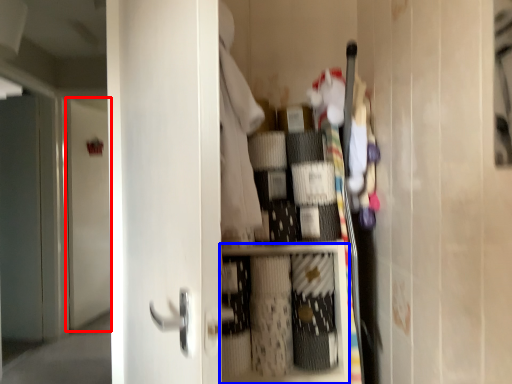
Question: Which of the following is the closest to the observer, door (highlighted by a red box) or cabinet (highlighted by a blue box)?

Choices:
 (A) door
 (B) cabinet

Answer: (B)